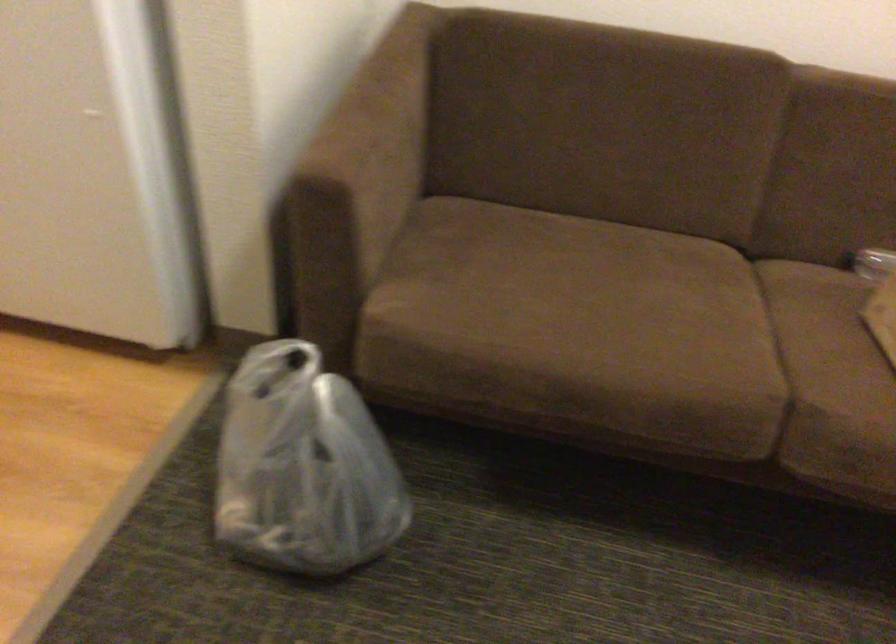
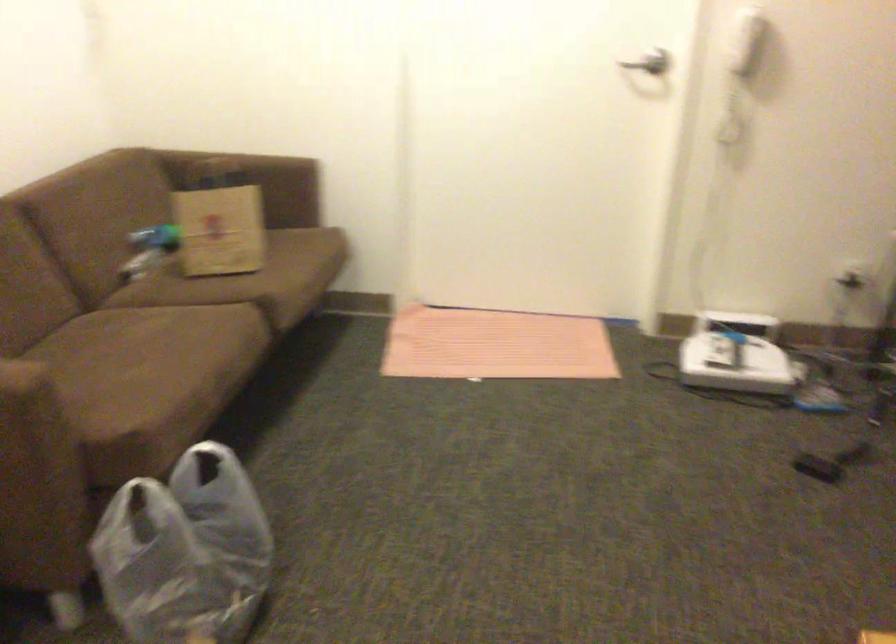
Find the pixel in the second image that matches point (271, 451) in the first image.

(167, 571)